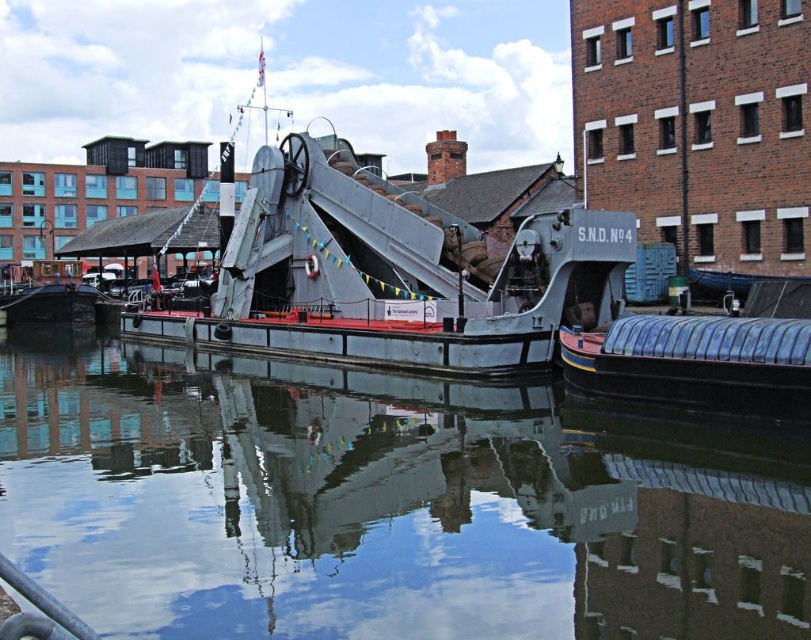
You are a photographer standing on the dock and want to capture both the transparent water at center and the metallic gray boat at center in a single shot. Which object should you focus on first to ensure both are in frame?

The transparent water at center is in front of the metallic gray boat at center, so you should focus on the metallic gray boat at center first to ensure both are in frame.

You are a photographer planning to capture the reflection of the industrial barge and its crane in the transparent water at center. However, you notice the blue rubber boat at lower right might block the reflection. Based on their sizes, which object would you need to move or avoid to ensure the reflection of the barge and crane is fully visible?

The transparent water at center has a larger size compared to the blue rubber boat at lower right. Therefore, to ensure the reflection of the barge and crane is fully visible, you should move or avoid the blue rubber boat at lower right since it is smaller and less likely to obstruct the larger area of transparent water at center.